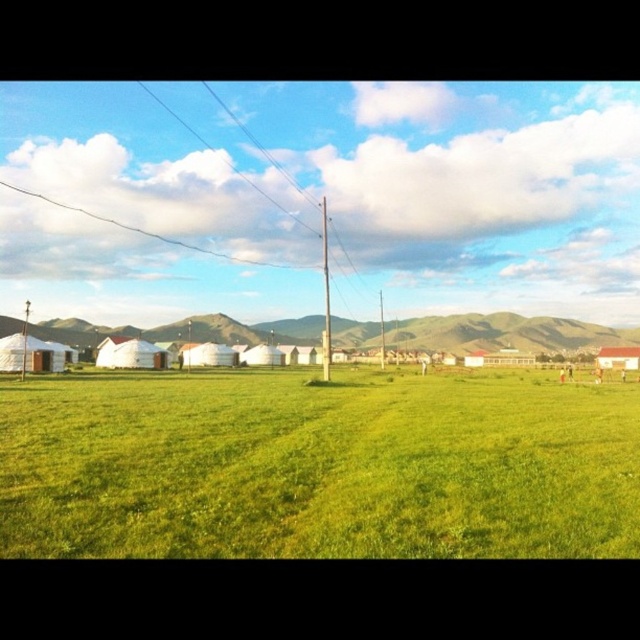
You are a photographer planning to capture the white fabric tent at center and the green grassy field at center in a single shot. Based on their positions, which object should you focus on first to ensure both are in frame?

The green grassy field at center is positioned on the right side of white fabric tent at center. To include both in the frame, focus on the white fabric tent at center first as it is on the left, allowing the green grassy field at center to naturally fall into the right side of the shot.

You are standing at the point closest to the viewer in the image, which is either point (x=371, y=500) or point (x=353, y=339). Which point are you standing at?

You are standing at point (x=371, y=500) because it is in front of point (x=353, y=339), making it closer to the viewer.

You are standing at the edge of the green grassy field at center and want to walk towards the metallic pole at center. Which direction should you face to reach it?

The green grassy field at center is to the right of the metallic pole at center, so you should face left to walk towards the metallic pole at center.